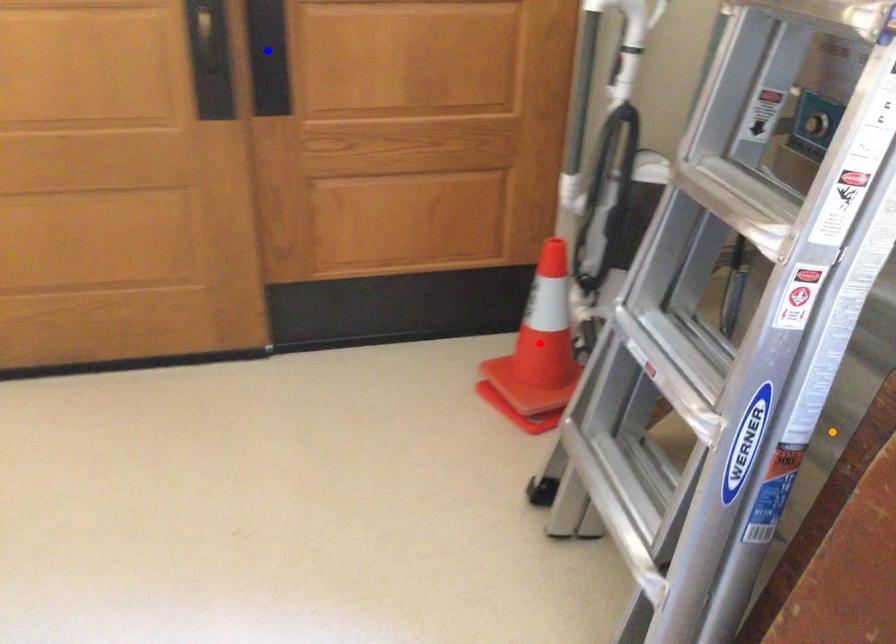
Order these from nearest to farthest:
A) blue point
B) orange point
C) red point

red point → blue point → orange point